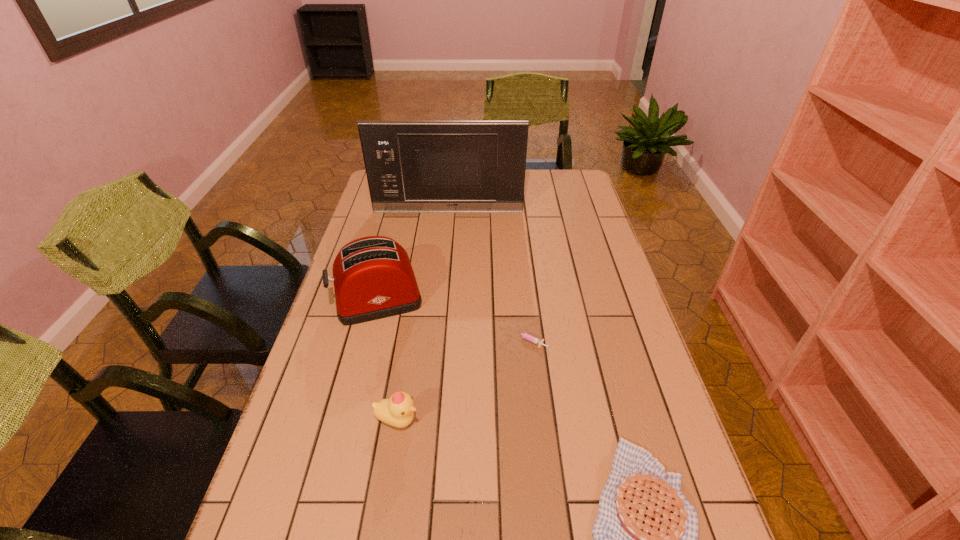
Where is `microwave oven`? microwave oven is located at coordinates (412, 166).

Locate an element on the screen. the tallest object is located at coordinates (412, 166).

This screenshot has height=540, width=960. Find the location of `toaster`. toaster is located at coordinates (373, 278).

You are a GUI agent. You are given a task and a screenshot of the screen. Output one action in this format:
    pyautogui.click(x=<x>, y=<y>)
    Task: Click on the second tallest object
    Image resolution: width=960 pixels, height=540 pixels.
    Given the screenshot: What is the action you would take?
    pyautogui.click(x=373, y=278)

Where is `duckling`? The image size is (960, 540). duckling is located at coordinates (398, 411).

Image resolution: width=960 pixels, height=540 pixels. Identify the location of the third tallest object. coord(398,411).

At what (x,y) coordinates should I click in order to perform the action: click on the shortest object. Please return your answer as a coordinate pair (x, y). The width and height of the screenshot is (960, 540). Looking at the image, I should click on (526, 336).

Image resolution: width=960 pixels, height=540 pixels. Find the location of `syringe`. syringe is located at coordinates (526, 336).

At what (x,y) coordinates should I click in order to perform the action: click on vacant space located 0.150m on the front panel of the farthest object. Please return your answer as a coordinate pair (x, y). The width and height of the screenshot is (960, 540). Looking at the image, I should click on (445, 235).

This screenshot has width=960, height=540. Identify the location of free location located on the right of the fourth nearest object. (478, 300).